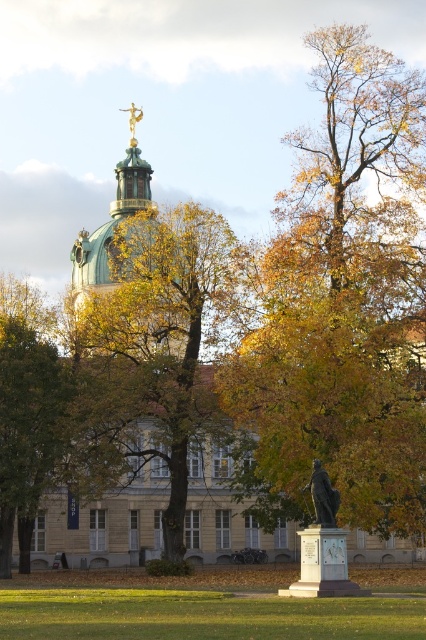
You are an architect visiting this historical building. You notice two elements at the upper center of the image. Which one is positioned higher between the green copper dome at upper center and the gold metallic statue at upper center?

The gold metallic statue at upper center is positioned higher because the green copper dome at upper center is located below it.

You are an architect visiting this historical building and want to compare the statues in front of the dome. Which statue is taller, the bronze statue at center or the gold metallic statue at upper center?

The gold metallic statue at upper center is taller than the bronze statue at center.